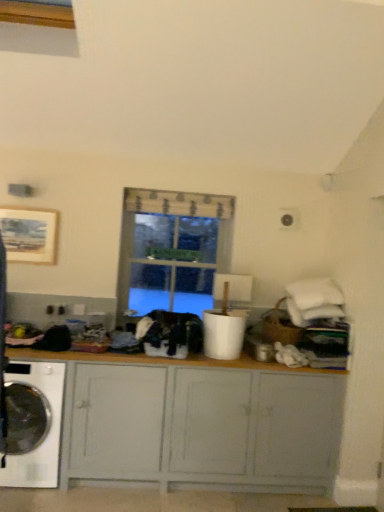
Question: Should I look upward or downward to see matte gray cabinet at center?

Choices:
 (A) down
 (B) up

Answer: (A)

Question: Does white glossy washing machine at lower left have a larger size compared to black fabric at center?

Choices:
 (A) no
 (B) yes

Answer: (B)

Question: From a real-world perspective, is white glossy washing machine at lower left on top of black fabric at center?

Choices:
 (A) yes
 (B) no

Answer: (B)

Question: Is white glossy washing machine at lower left wider than black fabric at center?

Choices:
 (A) yes
 (B) no

Answer: (A)

Question: From a real-world perspective, is white glossy washing machine at lower left physically below black fabric at center?

Choices:
 (A) no
 (B) yes

Answer: (B)

Question: Is white glossy washing machine at lower left thinner than black fabric at center?

Choices:
 (A) no
 (B) yes

Answer: (A)

Question: From the image's perspective, is white glossy washing machine at lower left above black fabric at center?

Choices:
 (A) no
 (B) yes

Answer: (A)

Question: Does black fabric at center have a greater width compared to clear glass window at center?

Choices:
 (A) no
 (B) yes

Answer: (A)

Question: Is black fabric at center taller than clear glass window at center?

Choices:
 (A) no
 (B) yes

Answer: (A)

Question: From the image's perspective, would you say black fabric at center is shown under clear glass window at center?

Choices:
 (A) no
 (B) yes

Answer: (B)

Question: Is black fabric at center turned away from clear glass window at center?

Choices:
 (A) yes
 (B) no

Answer: (A)

Question: Is black fabric at center not inside clear glass window at center?

Choices:
 (A) no
 (B) yes

Answer: (B)

Question: Is black fabric at center positioned in front of clear glass window at center?

Choices:
 (A) yes
 (B) no

Answer: (A)

Question: Is there a large distance between clear glass window at center and black fabric at center?

Choices:
 (A) no
 (B) yes

Answer: (A)